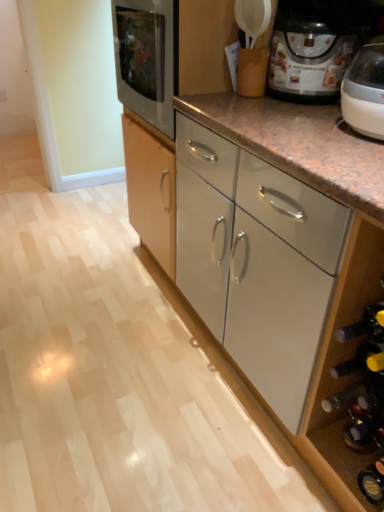
Identify the location of free spot above white glossy cabinet at center (from a real-world perspective). The image size is (384, 512). (104, 330).